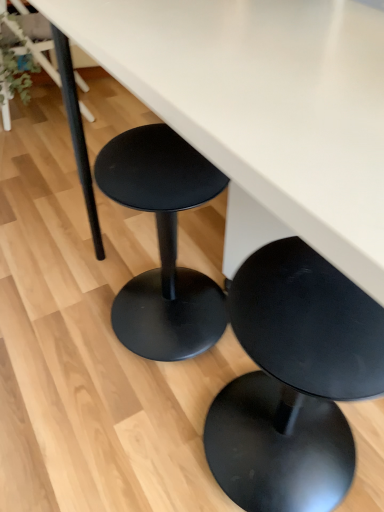
Where is `matte black stool at lower center`? This screenshot has width=384, height=512. matte black stool at lower center is located at coordinates (263, 110).

Describe the element at coordinates (263, 110) in the screenshot. The image size is (384, 512). I see `matte black stool at lower center` at that location.

Where is `matte black stool at lower center`? The width and height of the screenshot is (384, 512). matte black stool at lower center is located at coordinates (294, 381).

Between point (13, 90) and point (359, 350), which one is positioned in front?

The point (359, 350) is closer.

The image size is (384, 512). I want to click on plant behind the matte black stool at lower center, so click(x=15, y=68).

Which object is wider, green matte plant at upper left or matte black stool at lower center?

With larger width is matte black stool at lower center.

Considering the relative positions of green matte plant at upper left and matte black stool at lower center in the image provided, is green matte plant at upper left to the right of matte black stool at lower center from the viewer's perspective?

No, green matte plant at upper left is not to the right of matte black stool at lower center.

Find the location of a particular element. The height and width of the screenshot is (512, 384). table in front of the matte black stool at upper left is located at coordinates click(x=263, y=110).

Is matte black stool at upper left to the right of matte black stool at lower center from the viewer's perspective?

In fact, matte black stool at upper left is to the left of matte black stool at lower center.

Is matte black stool at upper left in front of or behind matte black stool at lower center in the image?

matte black stool at upper left is behind matte black stool at lower center.

Considering the points (87, 108) and (19, 72), which point is behind, point (87, 108) or point (19, 72)?

The point (87, 108) is farther from the camera.

Where is `plant below the matte black stool at upper left (from the image's perspective)`? Image resolution: width=384 pixels, height=512 pixels. plant below the matte black stool at upper left (from the image's perspective) is located at coordinates (15, 68).

From the image's perspective, is matte black stool at upper left beneath green matte plant at upper left?

No, from the image's perspective, matte black stool at upper left is not below green matte plant at upper left.

Can you confirm if matte black stool at upper left is bigger than green matte plant at upper left?

Yes, matte black stool at upper left is bigger than green matte plant at upper left.

Does point (157, 104) appear closer or farther from the camera than point (323, 471)?

Point (157, 104) is positioned closer to the camera compared to point (323, 471).

In the scene shown: Is there a large distance between matte black stool at lower center and matte black stool at lower center?

No.

Is matte black stool at lower center facing away from matte black stool at lower center?

Absolutely, matte black stool at lower center is directed away from matte black stool at lower center.

From a real-world perspective, does matte black stool at lower center stand above matte black stool at lower center?

Correct, in the physical world, matte black stool at lower center is higher than matte black stool at lower center.

Does point (240, 387) come farther from viewer compared to point (25, 104)?

No, (240, 387) is in front of (25, 104).

Between matte black stool at lower center and green matte plant at upper left, which one appears on the left side from the viewer's perspective?

green matte plant at upper left is more to the left.

Considering the sizes of matte black stool at lower center and green matte plant at upper left in the image, is matte black stool at lower center wider or thinner than green matte plant at upper left?

Considering their sizes, matte black stool at lower center looks broader than green matte plant at upper left.

Can we say matte black stool at lower center lies outside green matte plant at upper left?

Yes, matte black stool at lower center is not within green matte plant at upper left.

Is matte black stool at lower center taller or shorter than matte black stool at lower center?

Clearly, matte black stool at lower center is shorter compared to matte black stool at lower center.

In the scene shown: Between matte black stool at lower center and matte black stool at lower center, which one appears on the right side from the viewer's perspective?

From the viewer's perspective, matte black stool at lower center appears more on the right side.

Is matte black stool at lower center next to matte black stool at lower center and touching it?

They are not placed beside each other.

Is matte black stool at upper left to the left of matte black stool at lower center from the viewer's perspective?

Indeed, matte black stool at upper left is positioned on the left side of matte black stool at lower center.

Is matte black stool at upper left in contact with matte black stool at lower center?

There is a gap between matte black stool at upper left and matte black stool at lower center.

Between matte black stool at upper left and matte black stool at lower center, which one has more height?

matte black stool at lower center.

Where is `chair above the matte black stool at lower center (from a real-world perspective)`? chair above the matte black stool at lower center (from a real-world perspective) is located at coordinates (36, 42).

The width and height of the screenshot is (384, 512). I want to click on stool that appears below the green matte plant at upper left (from the image's perspective), so click(x=294, y=381).

You are a GUI agent. You are given a task and a screenshot of the screen. Output one action in this format:
    pyautogui.click(x=<x>, y=<y>)
    Task: Click on the chair below the matte black stool at lower center (from a real-world perspective)
    This screenshot has width=384, height=512.
    Given the screenshot: What is the action you would take?
    pyautogui.click(x=36, y=42)

Which object lies nearer to the anchor point green matte plant at upper left, matte black stool at lower center or matte black stool at upper left?

matte black stool at upper left is closer to green matte plant at upper left.

When comparing their distances from matte black stool at lower center, does matte black stool at lower center or green matte plant at upper left seem further?

green matte plant at upper left is further to matte black stool at lower center.

From the image, which object appears to be farther from matte black stool at upper left, matte black stool at lower center or green matte plant at upper left?

Based on the image, matte black stool at lower center appears to be further to matte black stool at upper left.

From the image, which object appears to be nearer to matte black stool at upper left, matte black stool at lower center or matte black stool at lower center?

The object closer to matte black stool at upper left is matte black stool at lower center.

Looking at the image, which one is located further to green matte plant at upper left, matte black stool at lower center or matte black stool at lower center?

Among the two, matte black stool at lower center is located further to green matte plant at upper left.

From the image, which object appears to be nearer to matte black stool at upper left, matte black stool at lower center or matte black stool at lower center?

matte black stool at lower center is closer to matte black stool at upper left.

Considering their positions, is green matte plant at upper left positioned closer to matte black stool at upper left than matte black stool at lower center?

green matte plant at upper left.

Considering their positions, is green matte plant at upper left positioned further to matte black stool at lower center than matte black stool at upper left?

The object further to matte black stool at lower center is green matte plant at upper left.

You are a GUI agent. You are given a task and a screenshot of the screen. Output one action in this format:
    pyautogui.click(x=<x>, y=<y>)
    Task: Click on the plant between matte black stool at lower center and matte black stool at upper left in the front-back direction
    The height and width of the screenshot is (512, 384).
    Given the screenshot: What is the action you would take?
    (x=15, y=68)

At what (x,y) coordinates should I click in order to perform the action: click on plant between matte black stool at upper left and matte black stool at lower center vertically. Please return your answer as a coordinate pair (x, y). Looking at the image, I should click on [x=15, y=68].

Locate an element on the screen. The image size is (384, 512). stool between matte black stool at lower center and green matte plant at upper left in the front-back direction is located at coordinates (294, 381).

Find the location of `stool between matte black stool at lower center and matte black stool at upper left in the front-back direction`. stool between matte black stool at lower center and matte black stool at upper left in the front-back direction is located at coordinates (294, 381).